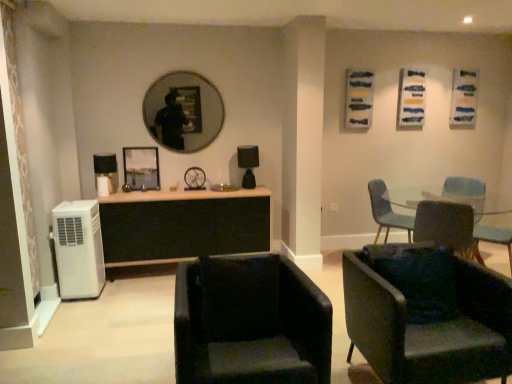
Where is `vacant region under matte black mirror at upper center (from a real-world perspective)`? vacant region under matte black mirror at upper center (from a real-world perspective) is located at coordinates (184, 188).